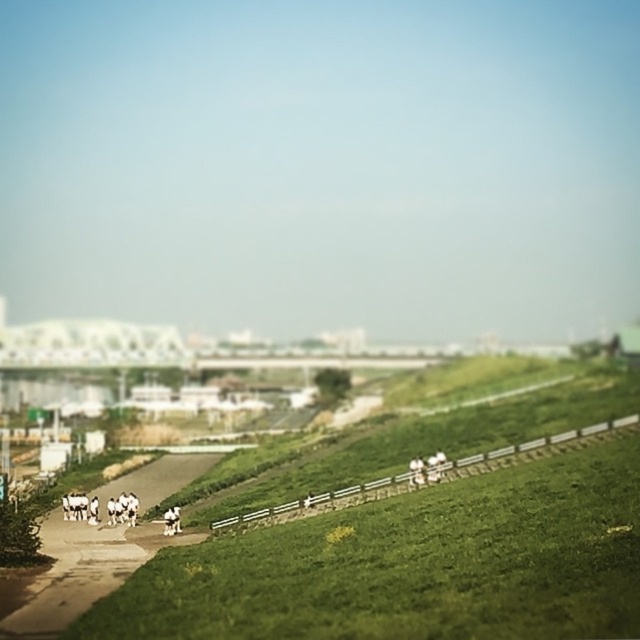
Question: Which object is closer to the camera taking this photo?

Choices:
 (A) white fur horse at lower left
 (B) white fluffy dog at lower left

Answer: (A)

Question: Which point is farther from the camera taking this photo?

Choices:
 (A) (67, 518)
 (B) (170, 525)

Answer: (A)

Question: From the image, what is the correct spatial relationship of white fluffy dog at lower left in relation to white fur horse at lower left?

Choices:
 (A) above
 (B) below

Answer: (B)

Question: Which point is closer to the camera taking this photo?

Choices:
 (A) (164, 512)
 (B) (80, 508)

Answer: (A)

Question: Can you confirm if white fluffy dog at lower left is thinner than white fur horse at lower left?

Choices:
 (A) no
 (B) yes

Answer: (A)

Question: Is white fluffy dog at lower left positioned at the back of white fur horse at lower left?

Choices:
 (A) no
 (B) yes

Answer: (B)